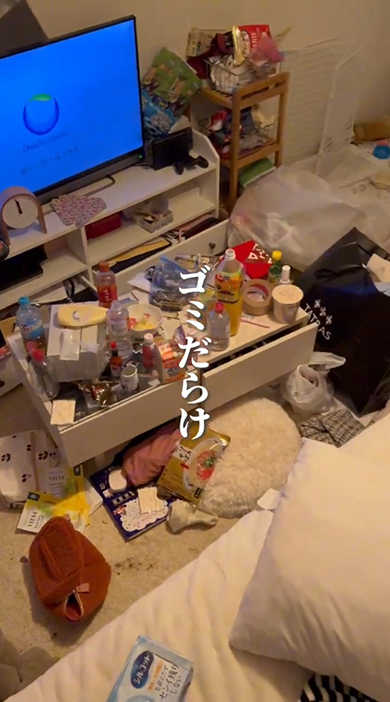
Locate an element on the screen. drawer is located at coordinates (x=248, y=373), (x=139, y=410).